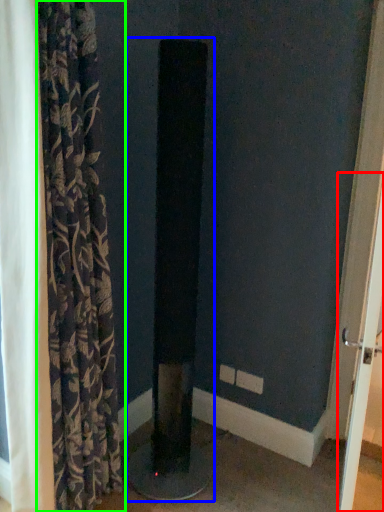
Question: Which is nearer to the screen door (highlighted by a red box)? pillar (highlighted by a blue box) or curtain (highlighted by a green box).

Choices:
 (A) pillar
 (B) curtain

Answer: (A)